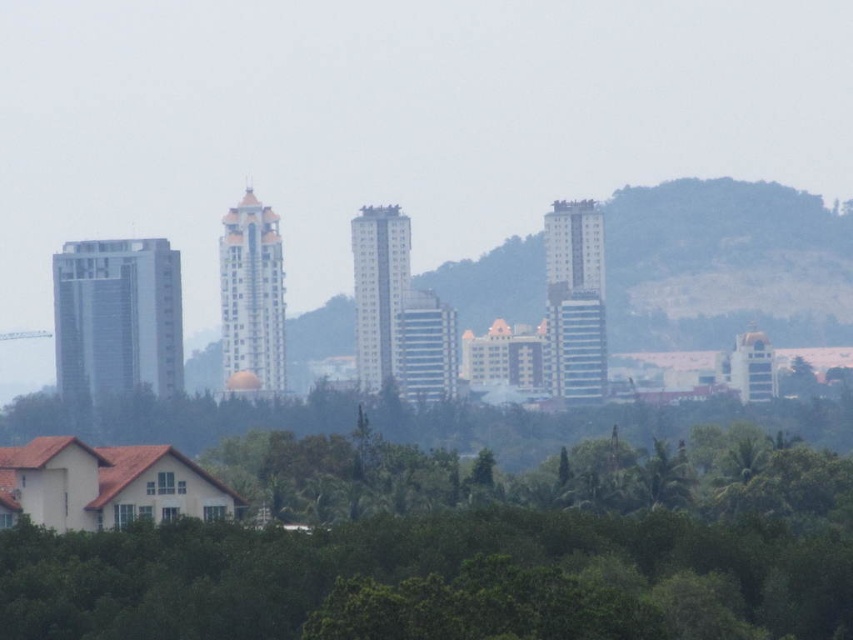
Can you confirm if green leafy trees at lower center is bigger than green grassy hillside at center?

Indeed, green leafy trees at lower center has a larger size compared to green grassy hillside at center.

Measure the distance between green leafy trees at lower center and camera.

The distance of green leafy trees at lower center from camera is 478.57 meters.

Is point (786, 483) in front of point (607, 268)?

Yes, it is.

This screenshot has height=640, width=853. Find the location of `green leafy trees at lower center`. green leafy trees at lower center is located at coordinates (459, 572).